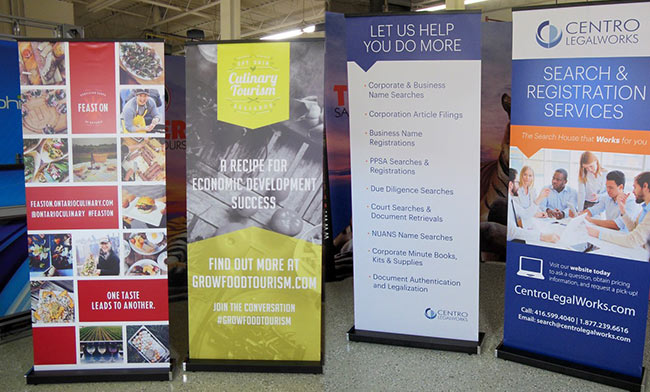
This screenshot has width=650, height=392. Find the location of `lights`. lights is located at coordinates (281, 35), (435, 7).